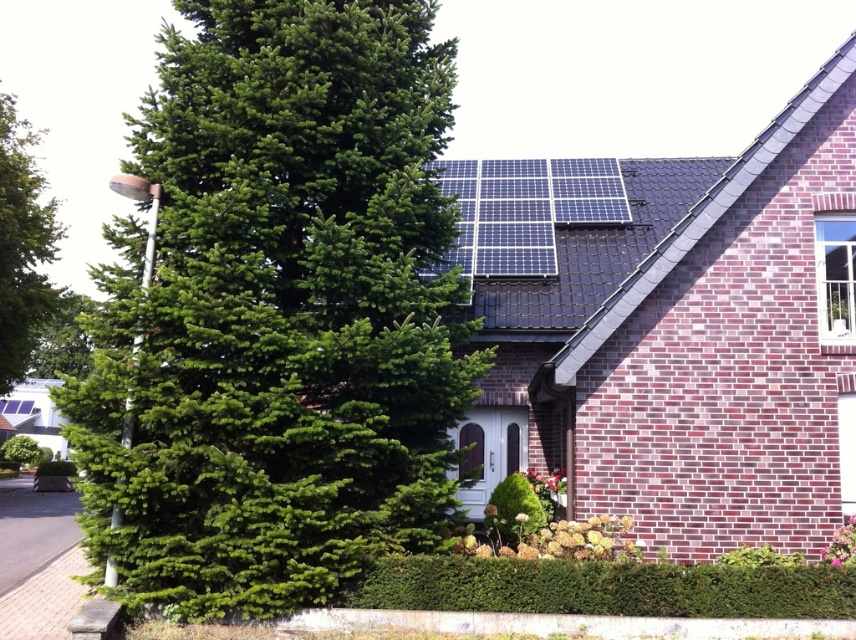
From the picture: You are standing in front of the residential building and want to take a photo of both the green matte tree at center and the green leafy tree at left. Which tree should you focus on first to ensure both are in clear view?

You should focus on the green leafy tree at left first because it is farther away from the viewer than the green matte tree at center. By focusing on the farther tree, you can ensure both are in clear view.

In the scene shown: You are a gardener planning to trim the trees in front of the house. You need to know which tree is shorter to decide where to start. Which tree is shorter between the green matte tree at center and the green leafy tree at left?

The green matte tree at center is shorter than the green leafy tree at left, so you should start trimming the green matte tree at center first.